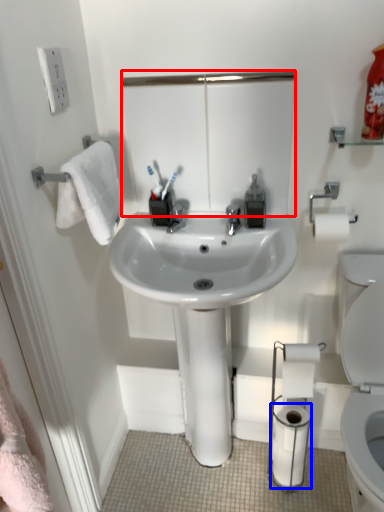
Question: Among these objects, which one is farthest to the camera, mirror (highlighted by a red box) or toilet paper (highlighted by a blue box)?

Choices:
 (A) mirror
 (B) toilet paper

Answer: (B)